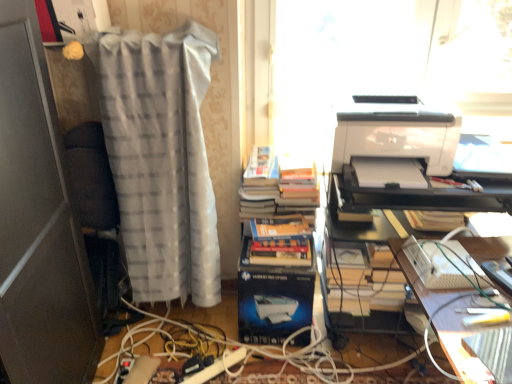
Locate an element on the screen. The height and width of the screenshot is (384, 512). free spot to the right of dark brown leather file cabinet at left is located at coordinates (147, 364).